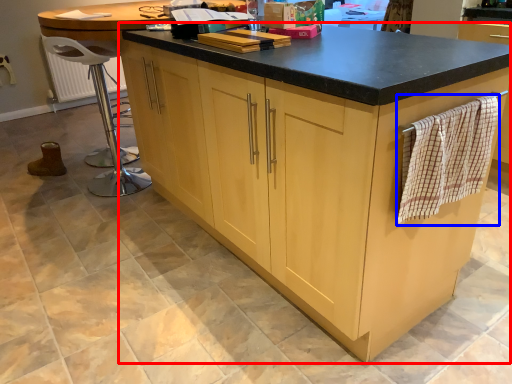
Question: Which object is further to the camera taking this photo, cabinetry (highlighted by a red box) or blanket (highlighted by a blue box)?

Choices:
 (A) cabinetry
 (B) blanket

Answer: (B)